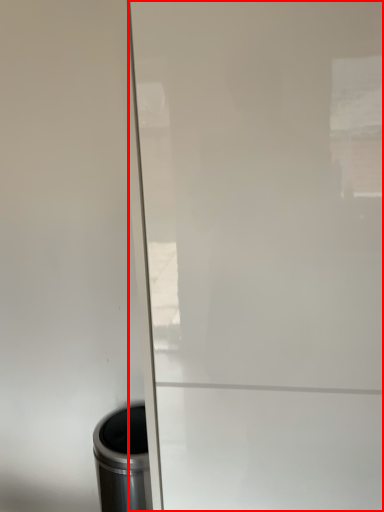
Question: Observing the image, what is the correct spatial positioning of screen door (annotated by the red box) in reference to waste container?

Choices:
 (A) left
 (B) right

Answer: (B)